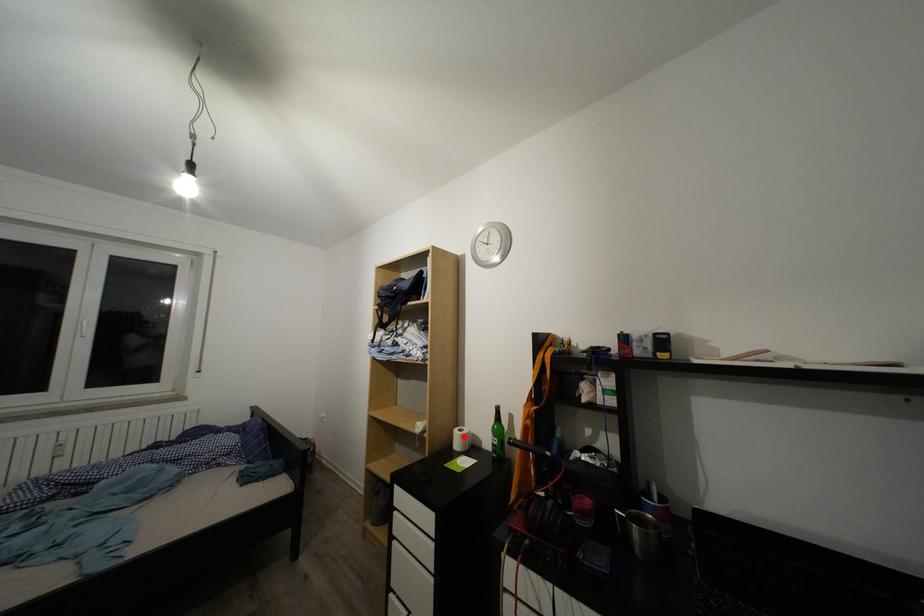
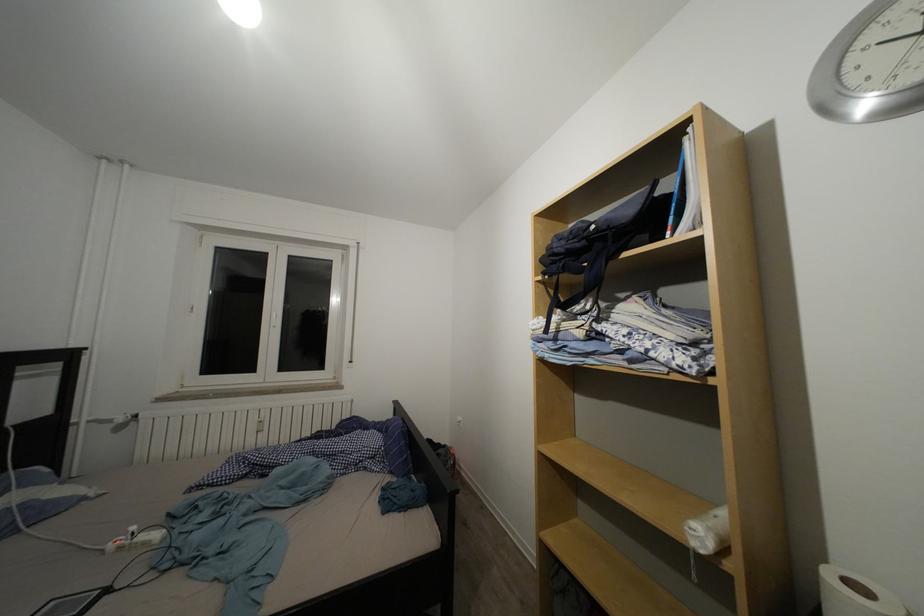
Question: I am providing you with two images of the same scene from different viewpoints. Given a red point in image1, look at the same physical point in image2. Is it:

Choices:
 (A) Closer to the viewpoint
 (B) Farther from the viewpoint

Answer: (A)